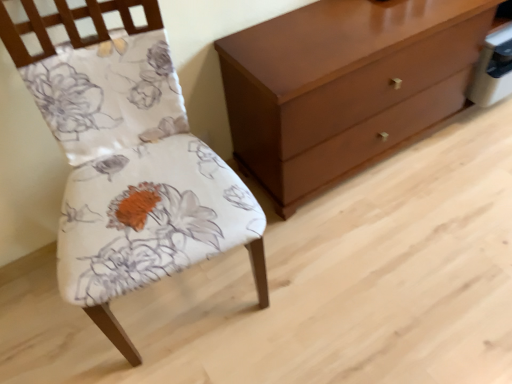
The height and width of the screenshot is (384, 512). Identify the location of vacant space that is in between floral fabric chair at left and matte brown chest of drawers at right. (357, 213).